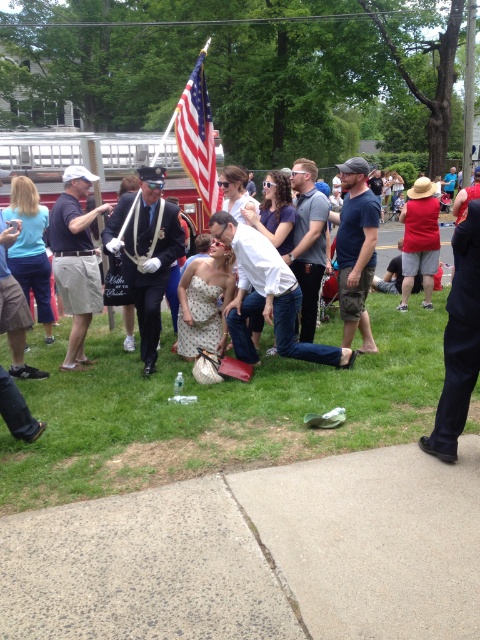
You are a photographer trying to capture a clear shot of the green grass at center and the matte black uniform at left. Based on their positions, which object is closer to the camera?

The green grass at center is closer to the camera because it is in front of the matte black uniform at left.

Consider the image. You are standing in the middle of the scene and want to walk towards the two points marked in the image. Which point, point (x=389, y=305) or point (x=348, y=324), is closer to you?

Point (x=389, y=305) is closer to you because it is further to the viewer than point (x=348, y=324).